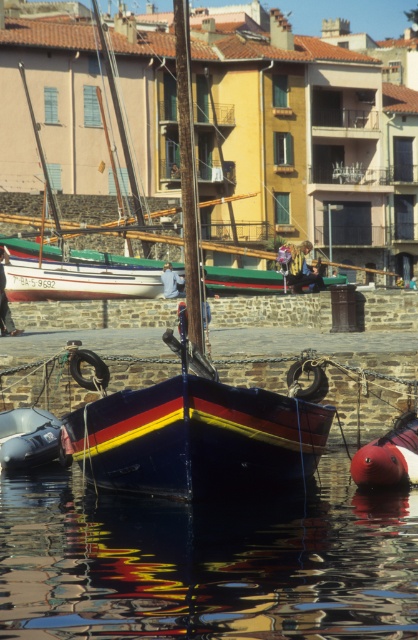
You are a dock worker who needs to secure the metallic blue boat at lower left to the rubber red buoy at lower right. Given that the rope you have is 25 feet long, will it be sufficient to reach between them?

The distance between the rubber red buoy at lower right and the metallic blue boat at lower left is 24.73 feet. Since the rope is 25 feet long, it is just long enough to secure the metallic blue boat at lower left to the rubber red buoy at lower right.

You are a sailor trying to secure your boat at the dock. You see the rubber red buoy at lower right and the metallic blue boat at lower left. Which object is narrower in width so you can pass through the narrow channel between them?

The rubber red buoy at lower right is thinner than the metallic blue boat at lower left, so you can pass through the narrow channel between them by navigating around the rubber red buoy at lower right since it has a narrower width.

You are standing on the dock looking at the glossy water at center and the rubber red buoy at lower right. Which object is positioned lower in the scene?

The glossy water at center is positioned below the rubber red buoy at lower right, so the glossy water at center is lower in the scene.